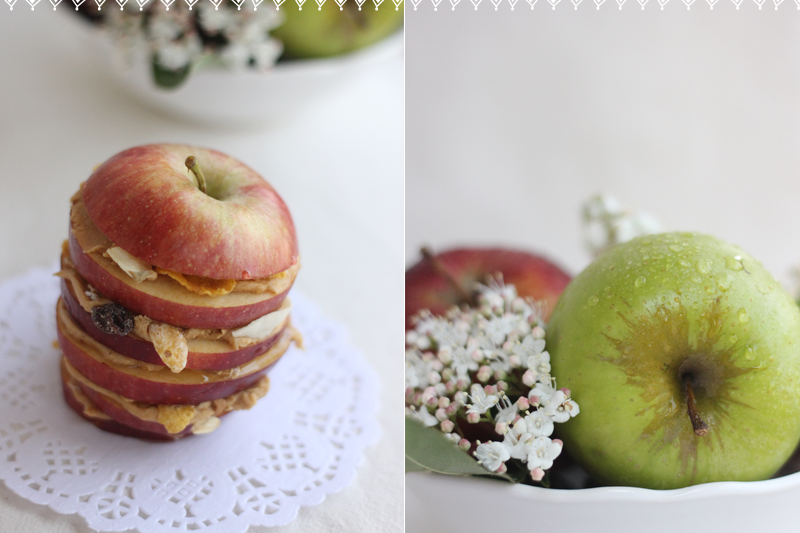
Find the location of a particular element. bowl is located at coordinates (722, 508).